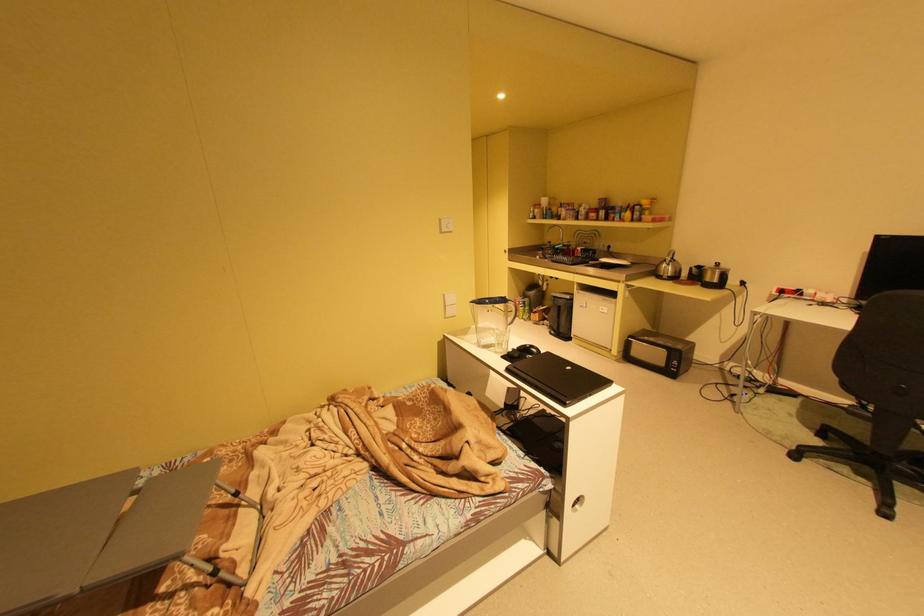
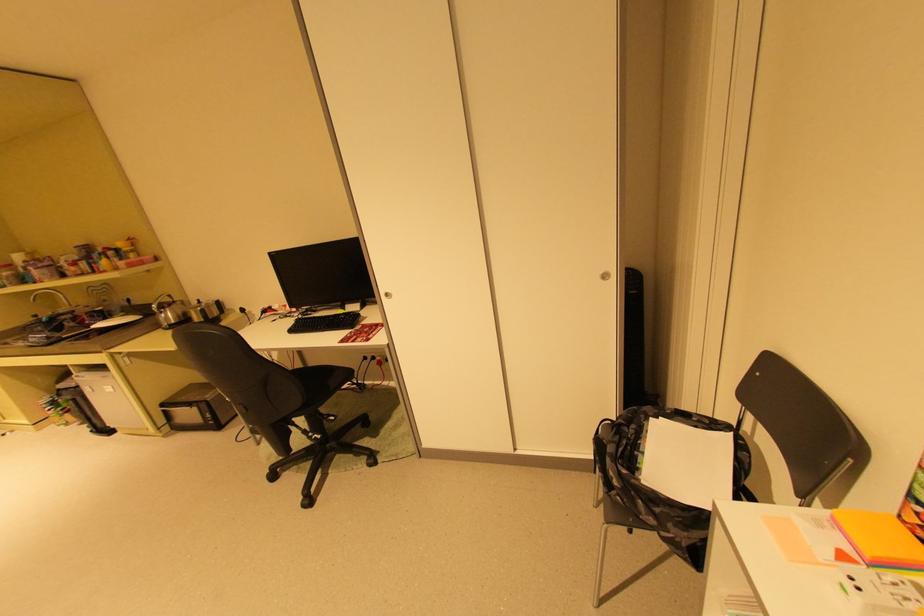
Where in the second image is the point corresponding to pixel 651 330 from the first image?

(199, 385)